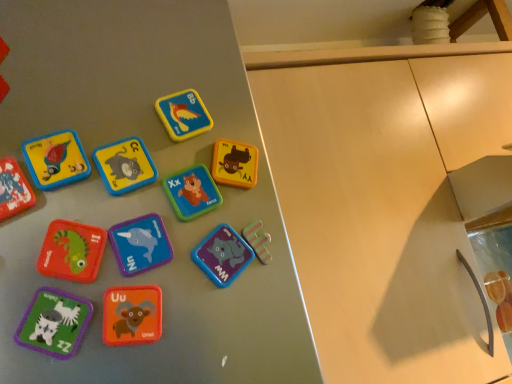
Question: From their relative heights in the image, would you say matte plastic letter at center, which ranks as the 7th toy in bottom-to-top order, is taller or shorter than purple matte magnet at center, marked as the third toy in a bottom-to-top arrangement?

Choices:
 (A) tall
 (B) short

Answer: (B)

Question: Choose the correct answer: Is matte plastic letter at center, which ranks as the 4th toy in top-to-bottom order, inside purple matte magnet at center, which appears as the 8th toy when viewed from the top, or outside it?

Choices:
 (A) inside
 (B) outside

Answer: (B)

Question: Based on their relative distances, which object is nearer to the purple matte magnet at center, which appears as the 8th toy when viewed from the top?

Choices:
 (A) orange matte letter u at center, the 10th toy from the top
 (B) matte yellow square at upper center, which is counted as the 1th toy, starting from the top
 (C) matte plastic letter at center, marked as the 3th toy in a top-to-bottom arrangement
 (D) matte green fabric zebra at lower left, arranged as the ninth toy when viewed from the top
 (E) matte wood cabinet at center

Answer: (A)

Question: Which object is the closest to the matte wood cabinet at center?

Choices:
 (A) matte green fabric zebra at lower left, which is the 2th toy in bottom-to-top order
 (B) matte plastic letter at center, positioned as the eighth toy in bottom-to-top order
 (C) matte plastic magnet at left, marked as the fifth toy in a top-to-bottom arrangement
 (D) matte yellow square at upper center, which is counted as the 1th toy, starting from the top
 (E) purple matte dolphin at center, positioned as the sixth toy in top-to-bottom order

Answer: (D)